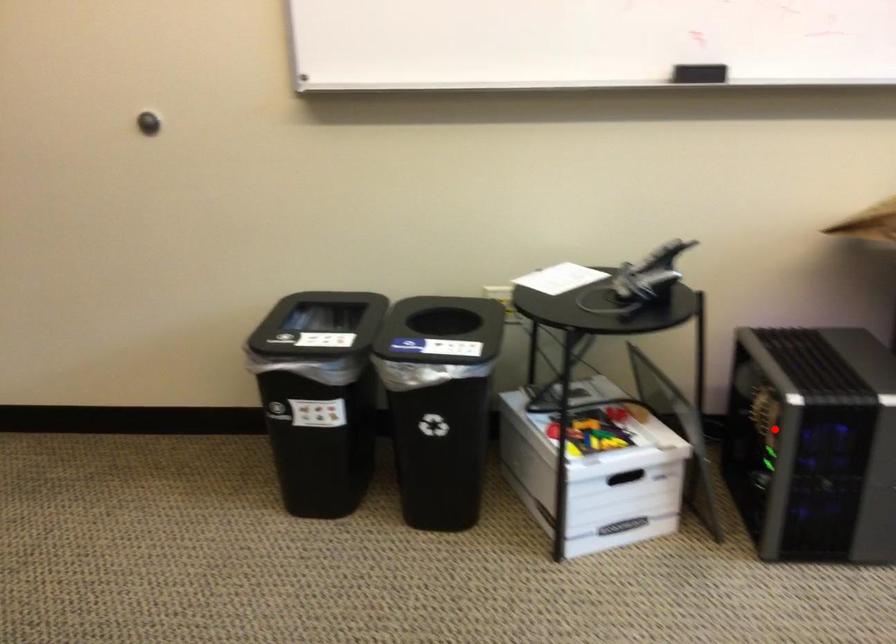
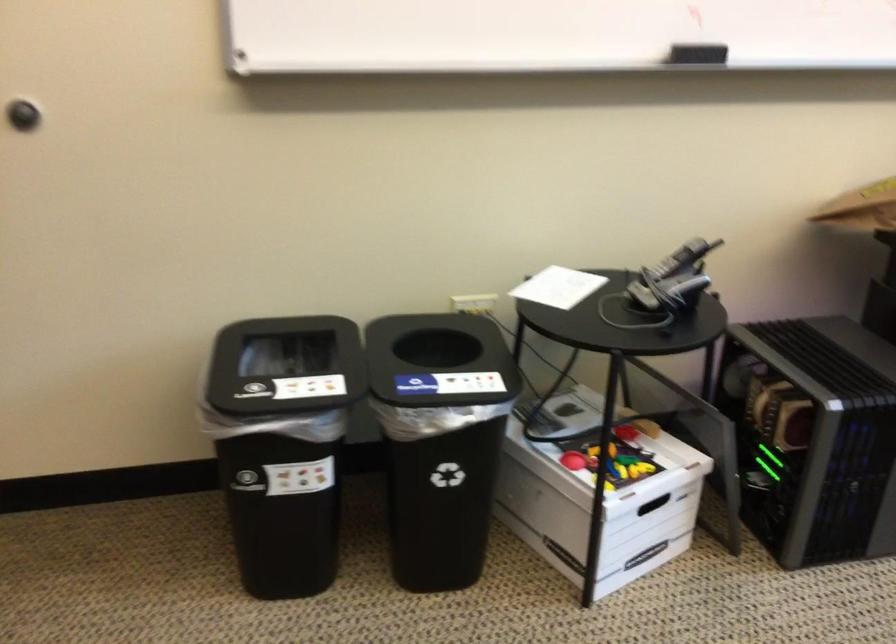
Question: I am providing you with two images of the same scene from different viewpoints. Image1 has a red point marked. In image2, the corresponding 3D location appears at what relative position? Reply with the corresponding letter.

Choices:
 (A) Closer
 (B) Farther

Answer: (A)